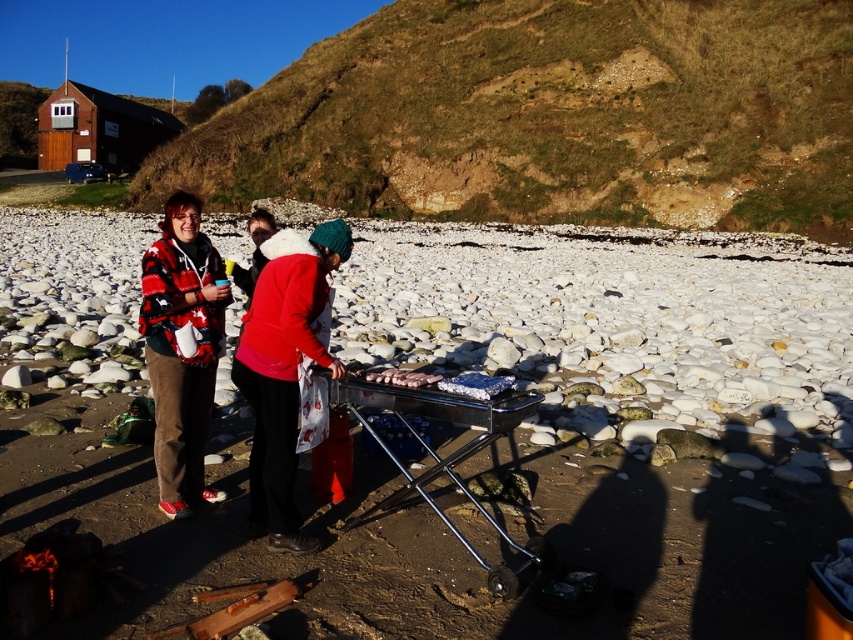
Question: Does red fleece jacket at center appear over metallic silver barbecue grill at center?

Choices:
 (A) no
 (B) yes

Answer: (B)

Question: Can you confirm if brown grassy hillside at upper center is positioned below charcoal grill at center?

Choices:
 (A) no
 (B) yes

Answer: (A)

Question: Which of the following is the farthest from the observer?

Choices:
 (A) flannel shirt at left
 (B) charcoal grill at center
 (C) metallic silver barbecue grill at center

Answer: (A)

Question: Estimate the real-world distances between objects in this image. Which object is farther from the stainless steel grill at center?

Choices:
 (A) charcoal grill at center
 (B) red fleece jacket at center
 (C) metallic silver barbecue grill at center
 (D) brown grassy hillside at upper center

Answer: (D)

Question: Does stainless steel grill at center come behind metallic silver barbecue grill at center?

Choices:
 (A) no
 (B) yes

Answer: (B)

Question: Which of these objects is positioned farthest from the stainless steel grill at center?

Choices:
 (A) red fleece jacket at center
 (B) flannel shirt at left
 (C) brown grassy hillside at upper center
 (D) charcoal grill at center

Answer: (C)